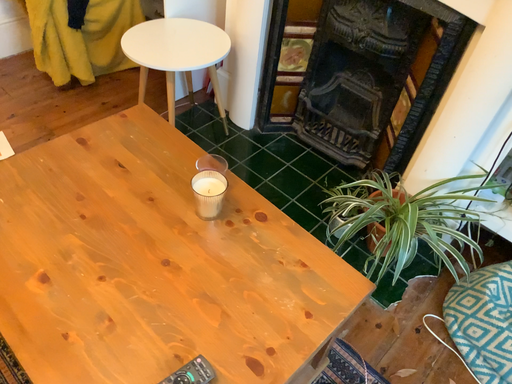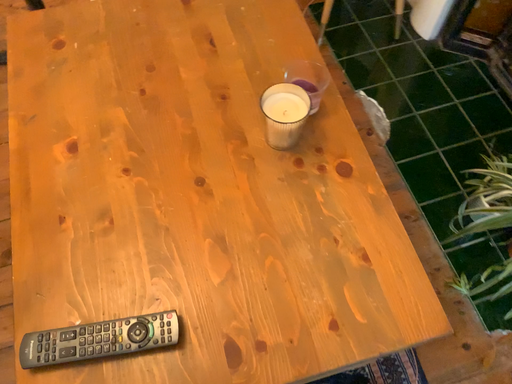
Question: Which way did the camera rotate in the video?

Choices:
 (A) rotated left
 (B) rotated right

Answer: (A)